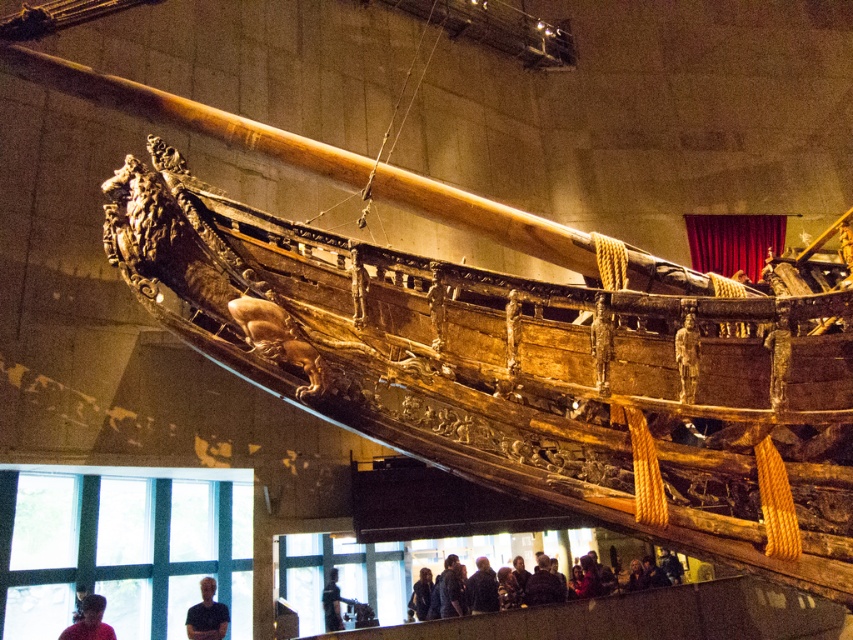
Question: Which of these objects is positioned closest to the dark gray fabric jacket at lower center?

Choices:
 (A) red fabric person at lower left
 (B) dark brown leather jacket at lower center
 (C) dark blue shirt at lower left
 (D) wooden ship at center

Answer: (C)

Question: Considering the real-world distances, which object is closest to the red fabric person at lower left?

Choices:
 (A) wooden ship at center
 (B) dark brown leather jacket at lower center
 (C) dark gray fabric jacket at lower center

Answer: (C)

Question: Where is wooden ship at center located in relation to red fabric person at lower left in the image?

Choices:
 (A) right
 (B) left

Answer: (A)

Question: Can you confirm if dark brown leather jacket at lower center is positioned to the left of dark gray fabric jacket at lower center?

Choices:
 (A) yes
 (B) no

Answer: (B)

Question: Is dark brown leather jacket at lower center below dark gray fabric jacket at lower center?

Choices:
 (A) yes
 (B) no

Answer: (B)

Question: Which point is closer to the camera?

Choices:
 (A) wooden ship at center
 (B) dark gray fabric jacket at lower center
 (C) dark brown leather jacket at lower center
 (D) dark blue shirt at lower left

Answer: (A)